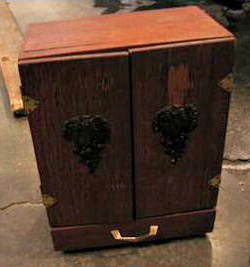
Locate an element on the screen. floor is located at coordinates (13, 182), (241, 117), (233, 214).